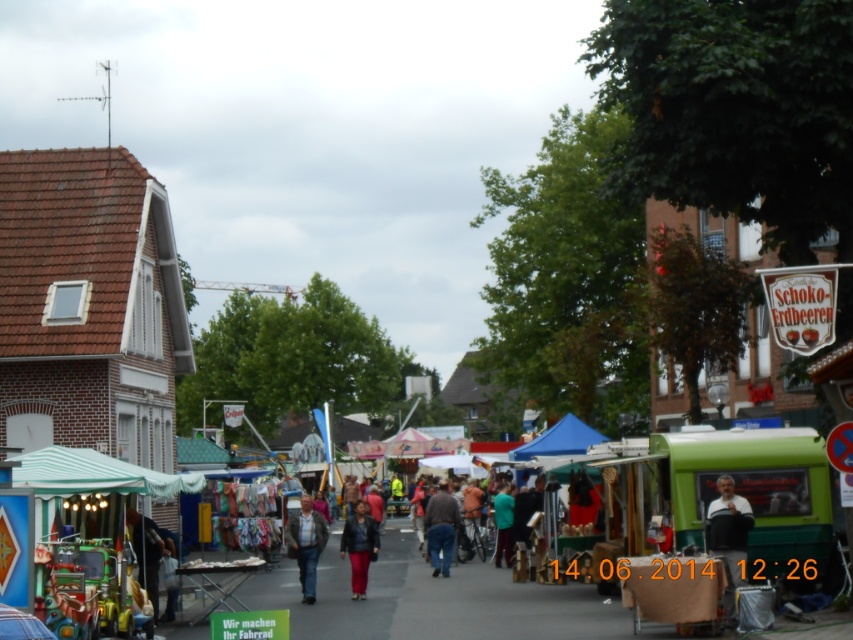
Does dark brown leather jacket at center have a larger size compared to green fabric jacket at center?

Actually, dark brown leather jacket at center might be smaller than green fabric jacket at center.

Does dark brown leather jacket at center appear on the right side of green fabric jacket at center?

In fact, dark brown leather jacket at center is to the left of green fabric jacket at center.

Describe the element at coordinates (440, 528) in the screenshot. I see `dark brown leather jacket at center` at that location.

Locate an element on the screen. The width and height of the screenshot is (853, 640). dark brown leather jacket at center is located at coordinates (440, 528).

Can you confirm if dark gray sweater at center is wider than matte black jacket at center?

No.

Does point (734, 522) come in front of point (364, 506)?

That is True.

Which is behind, point (730, 552) or point (350, 552)?

The point (350, 552) is behind.

In order to click on dark gray sweater at center in this screenshot , I will do `click(728, 536)`.

Which of these two, green fabric stall at center or green fabric jacket at center, stands shorter?

green fabric jacket at center is shorter.

Does green fabric stall at center have a lesser width compared to green fabric jacket at center?

In fact, green fabric stall at center might be wider than green fabric jacket at center.

This screenshot has width=853, height=640. Describe the element at coordinates (737, 436) in the screenshot. I see `green fabric stall at center` at that location.

Where is `green fabric stall at center`? The height and width of the screenshot is (640, 853). green fabric stall at center is located at coordinates (737, 436).